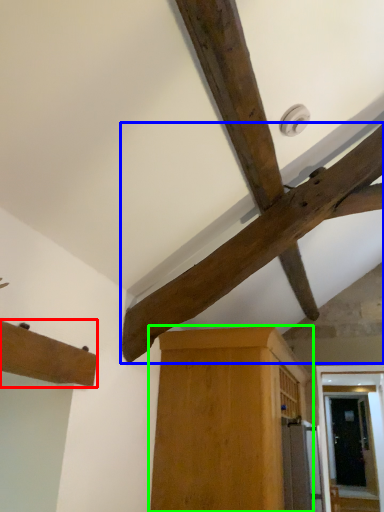
Question: Which object is positioned closest to cabinetry (highlighted by a red box)? Select from beam (highlighted by a blue box) and cabinetry (highlighted by a green box).

Choices:
 (A) beam
 (B) cabinetry

Answer: (A)